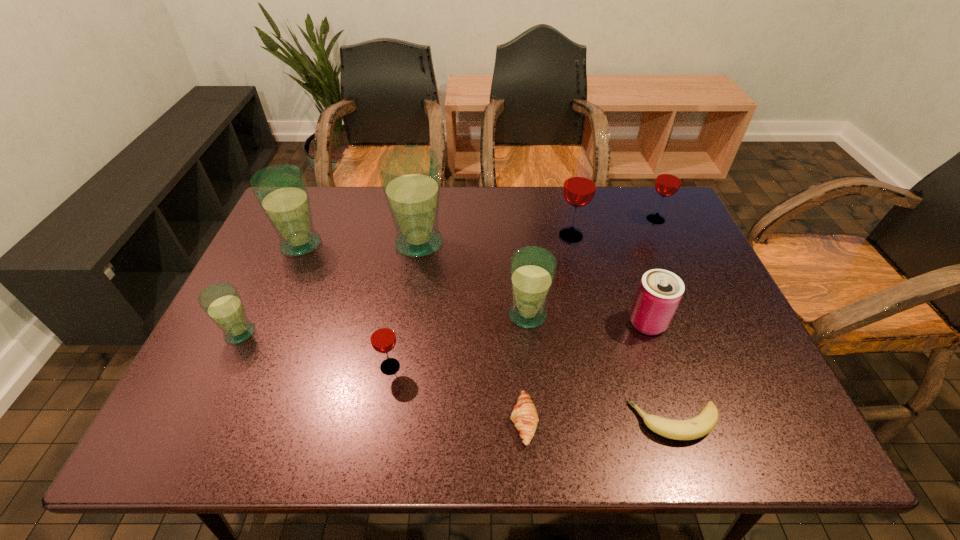
This screenshot has width=960, height=540. I want to click on free space in the image that satisfies the following two spatial constraints: 1. on the back side of the smallest blue glass; 2. on the left side of the third smallest blue glass, so click(282, 244).